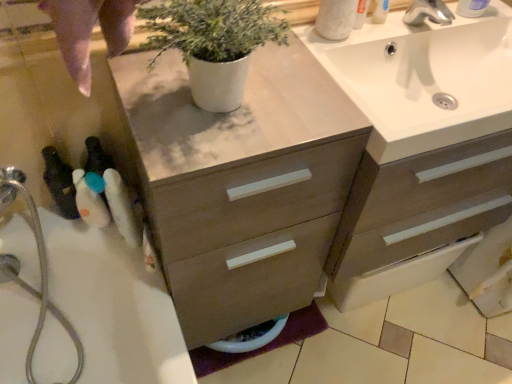
What are the coordinates of `free location to the right of white glossy pot at center` in the screenshot? It's located at (318, 107).